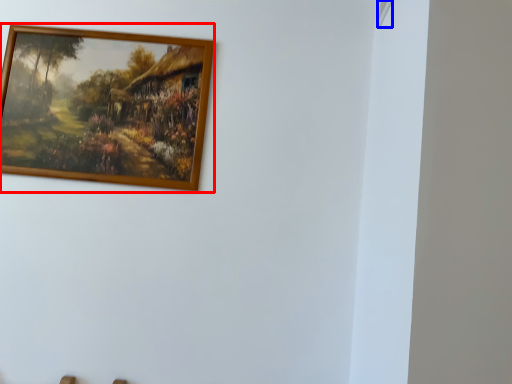
Question: Which of the following is the farthest to the observer, picture frame (highlighted by a red box) or window (highlighted by a blue box)?

Choices:
 (A) picture frame
 (B) window

Answer: (A)